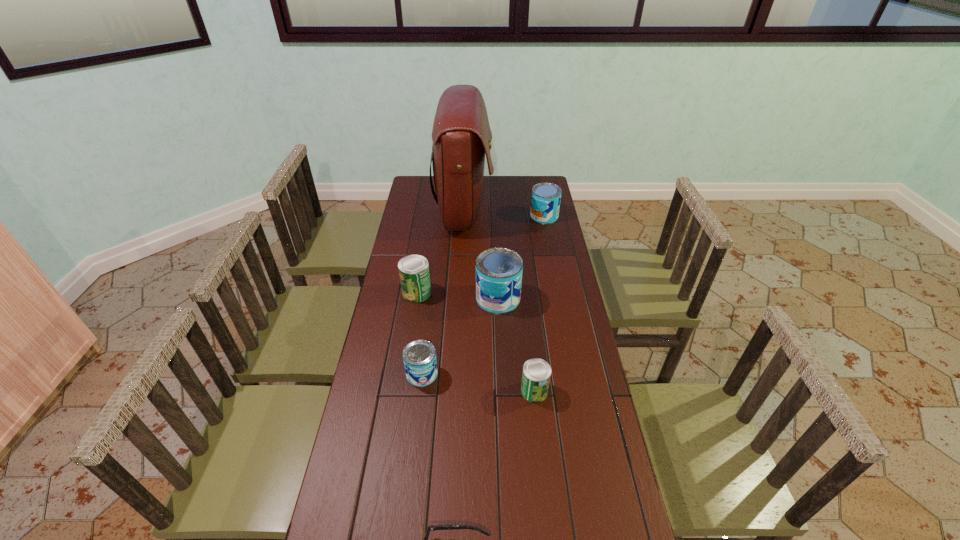
You are a GUI agent. You are given a task and a screenshot of the screen. Output one action in this format:
    pyautogui.click(x=<x>, y=<y>)
    Task: Click on the free location that satisfies the following two spatial constraints: 1. on the open flap of the rightmost can; 2. on the left side of the tallest object
    
    Given the screenshot: What is the action you would take?
    pyautogui.click(x=463, y=216)

This screenshot has width=960, height=540. I want to click on vacant space that satisfies the following two spatial constraints: 1. on the open flap of the brown satchel; 2. on the left side of the farthest blue can, so click(x=463, y=216).